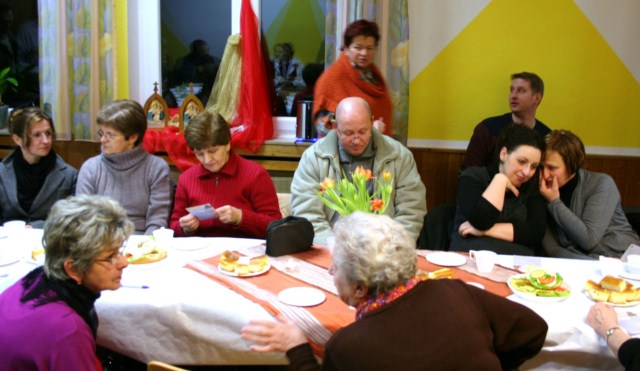
At what (x,y) coordinates should I click in order to perform the action: click on small empty plate above hand. Please return your answer as a coordinate pair (x, y). The image size is (640, 371). Looking at the image, I should click on (301, 290).